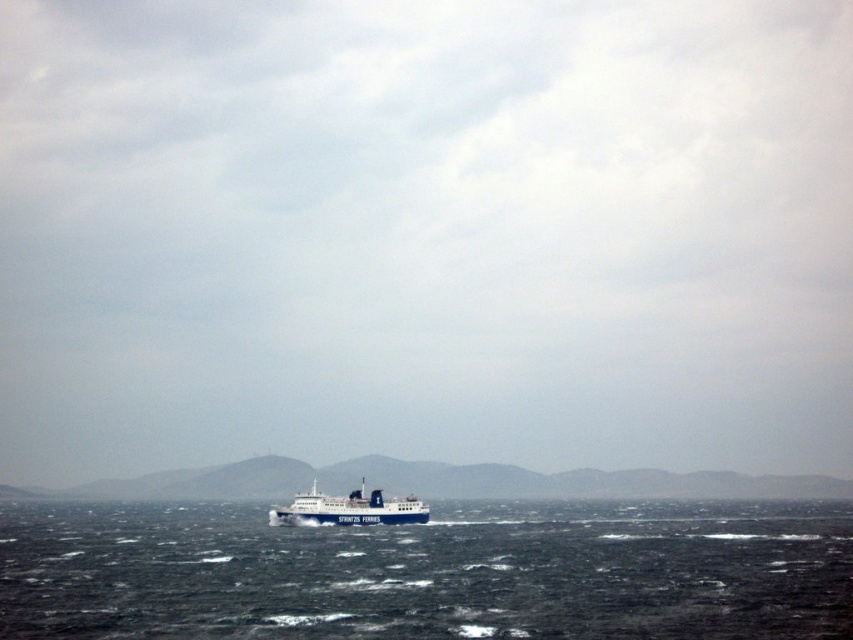
Is dark blue water at center behind blue matte ferry at center?

No.

Does point (601, 541) lie behind point (314, 477)?

That is False.

The image size is (853, 640). In order to click on dark blue water at center in this screenshot , I will do `click(428, 572)`.

Which is behind, point (816, 612) or point (126, 486)?

Positioned behind is point (126, 486).

Does dark blue water at center have a lesser height compared to white matte horizon at center?

No.

Is point (838, 525) closer to camera compared to point (74, 493)?

Yes, it is in front of point (74, 493).

Where is `dark blue water at center`? The image size is (853, 640). dark blue water at center is located at coordinates (428, 572).

Does white matte horizon at center appear under blue matte ferry at center?

Correct, white matte horizon at center is located below blue matte ferry at center.

The image size is (853, 640). I want to click on white matte horizon at center, so click(444, 483).

Where is `white matte horizon at center`? The width and height of the screenshot is (853, 640). white matte horizon at center is located at coordinates point(444,483).